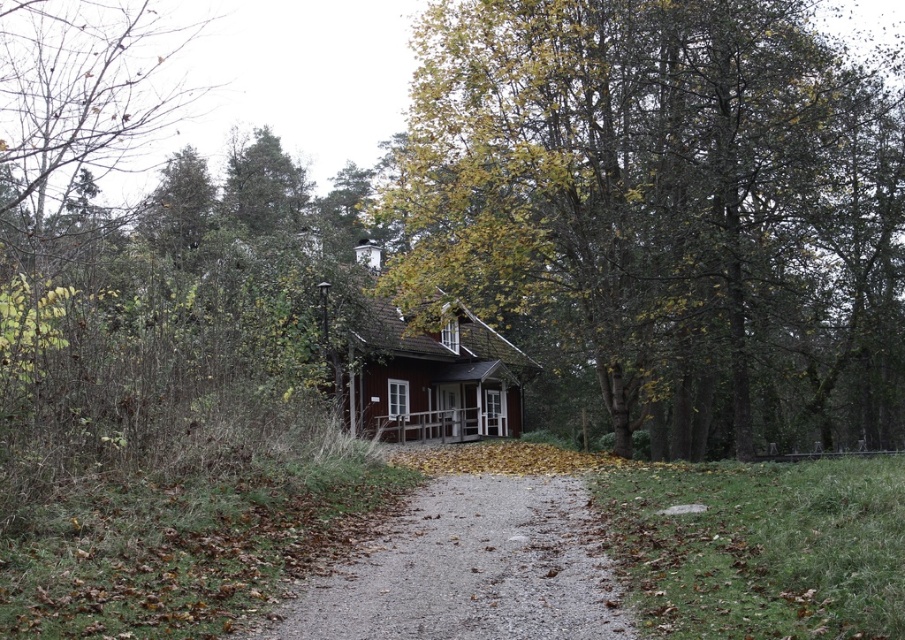
Question: Is gray gravel path at center above wooden cottage at center?

Choices:
 (A) no
 (B) yes

Answer: (A)

Question: Is green leafy tree at center closer to the viewer compared to gray gravel path at center?

Choices:
 (A) no
 (B) yes

Answer: (A)

Question: Estimate the real-world distances between objects in this image. Which object is closer to the gray gravel path at center?

Choices:
 (A) wooden cottage at center
 (B) green leafy tree at center

Answer: (B)

Question: Which point appears closest to the camera in this image?

Choices:
 (A) (389, 326)
 (B) (393, 620)
 (C) (518, 230)

Answer: (B)

Question: Based on their relative distances, which object is farther from the gray gravel path at center?

Choices:
 (A) wooden cottage at center
 (B) green leafy tree at center

Answer: (A)

Question: Does green leafy tree at center have a lesser width compared to wooden cottage at center?

Choices:
 (A) no
 (B) yes

Answer: (A)